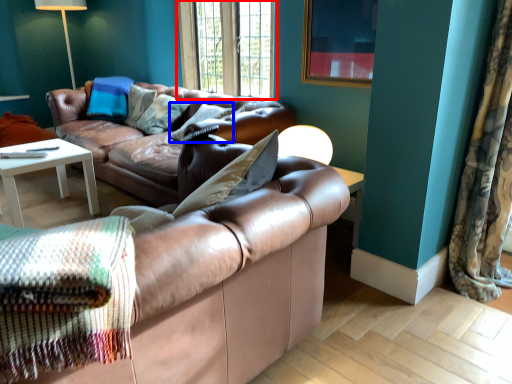
Question: Which object appears farthest to the camera in this image, window (highlighted by a red box) or pillow (highlighted by a blue box)?

Choices:
 (A) window
 (B) pillow

Answer: (A)